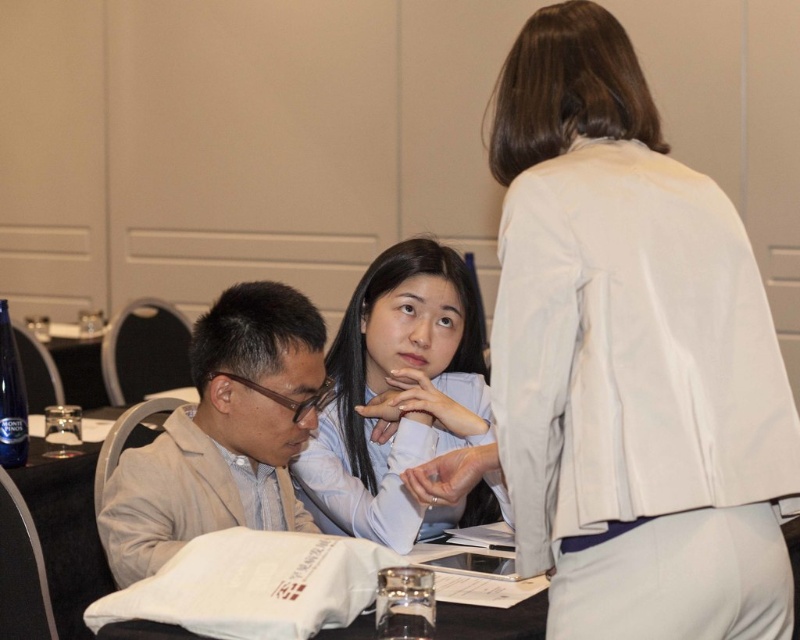
You are a photographer trying to capture a closeup of the white paper bag at lower center during the meeting. The light blue shirt at center is blocking your view. Can you tell me which object is bigger so I know which one to move?

The light blue shirt at center is larger in size than the white paper bag at lower center, so you should move the light blue shirt at center to get a clear view of the white paper bag at lower center.

You are a delivery person who just arrived at the conference room. You need to place a package on the table between the beige fabric suit at left and the white paper bag at lower center. The package is 12 inches long. Can you fit it there without moving either object?

The beige fabric suit at left and white paper bag at lower center are 11.49 inches apart. Since the package is 12 inches long, which is slightly longer than the available space, you cannot fit it between them without moving either object.

You are an interior designer analyzing the seating arrangement in this professional meeting scene. The light blue shirt at center and the beige fabric suit at left are both visible from your perspective. Which object occupies a taller position in this arrangement?

The light blue shirt at center has a greater height compared to the beige fabric suit at left, so the light blue shirt at center occupies a taller position in this arrangement.